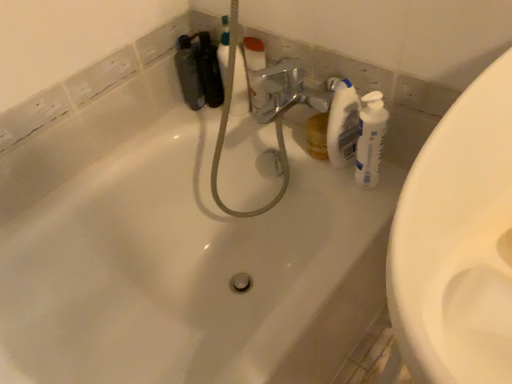
Question: Is matte black bottle at upper left not close to translucent plastic bottle at upper right, acting as the 2th cleaning product starting from the right?

Choices:
 (A) yes
 (B) no

Answer: (B)

Question: Is matte black bottle at upper left smaller than translucent plastic bottle at upper right, acting as the 2th cleaning product starting from the right?

Choices:
 (A) no
 (B) yes

Answer: (A)

Question: From the image's perspective, is matte black bottle at upper left under translucent plastic bottle at upper right, acting as the first cleaning product starting from the left?

Choices:
 (A) no
 (B) yes

Answer: (A)

Question: From the image's perspective, is matte black bottle at upper left on translucent plastic bottle at upper right, acting as the first cleaning product starting from the left?

Choices:
 (A) no
 (B) yes

Answer: (B)

Question: Is matte black bottle at upper left at the left side of translucent plastic bottle at upper right, acting as the 2th cleaning product starting from the right?

Choices:
 (A) no
 (B) yes

Answer: (B)

Question: From their relative heights in the image, would you say white plastic bottle at right, placed as the second cleaning product when sorted from left to right, is taller or shorter than translucent plastic bottle at upper right, acting as the 2th cleaning product starting from the right?

Choices:
 (A) short
 (B) tall

Answer: (A)

Question: Considering the positions of white plastic bottle at right, the first cleaning product positioned from the right, and translucent plastic bottle at upper right, acting as the first cleaning product starting from the left, in the image, is white plastic bottle at right, the first cleaning product positioned from the right, wider or thinner than translucent plastic bottle at upper right, acting as the first cleaning product starting from the left,?

Choices:
 (A) wide
 (B) thin

Answer: (A)

Question: From a real-world perspective, is white plastic bottle at right, placed as the second cleaning product when sorted from left to right, physically located above or below translucent plastic bottle at upper right, acting as the first cleaning product starting from the left?

Choices:
 (A) below
 (B) above

Answer: (A)

Question: In the image, is white plastic bottle at right, placed as the second cleaning product when sorted from left to right, positioned in front of or behind translucent plastic bottle at upper right, acting as the first cleaning product starting from the left?

Choices:
 (A) front
 (B) behind

Answer: (A)

Question: Does point (179, 74) appear closer or farther from the camera than point (335, 162)?

Choices:
 (A) farther
 (B) closer

Answer: (A)

Question: Is matte black bottle at upper left situated inside translucent plastic bottle at upper right, acting as the 2th cleaning product starting from the right, or outside?

Choices:
 (A) inside
 (B) outside

Answer: (B)

Question: Considering the positions of matte black bottle at upper left and translucent plastic bottle at upper right, acting as the first cleaning product starting from the left, in the image, is matte black bottle at upper left taller or shorter than translucent plastic bottle at upper right, acting as the first cleaning product starting from the left,?

Choices:
 (A) short
 (B) tall

Answer: (A)

Question: In terms of width, does matte black bottle at upper left look wider or thinner when compared to translucent plastic bottle at upper right, acting as the 2th cleaning product starting from the right?

Choices:
 (A) wide
 (B) thin

Answer: (A)

Question: Considering the positions of translucent plastic bottle at upper right, acting as the 2th cleaning product starting from the right, and white plastic bottle at right, placed as the second cleaning product when sorted from left to right, in the image, is translucent plastic bottle at upper right, acting as the 2th cleaning product starting from the right, taller or shorter than white plastic bottle at right, placed as the second cleaning product when sorted from left to right,?

Choices:
 (A) tall
 (B) short

Answer: (A)

Question: Does point (330, 86) appear closer or farther from the camera than point (356, 145)?

Choices:
 (A) closer
 (B) farther

Answer: (B)